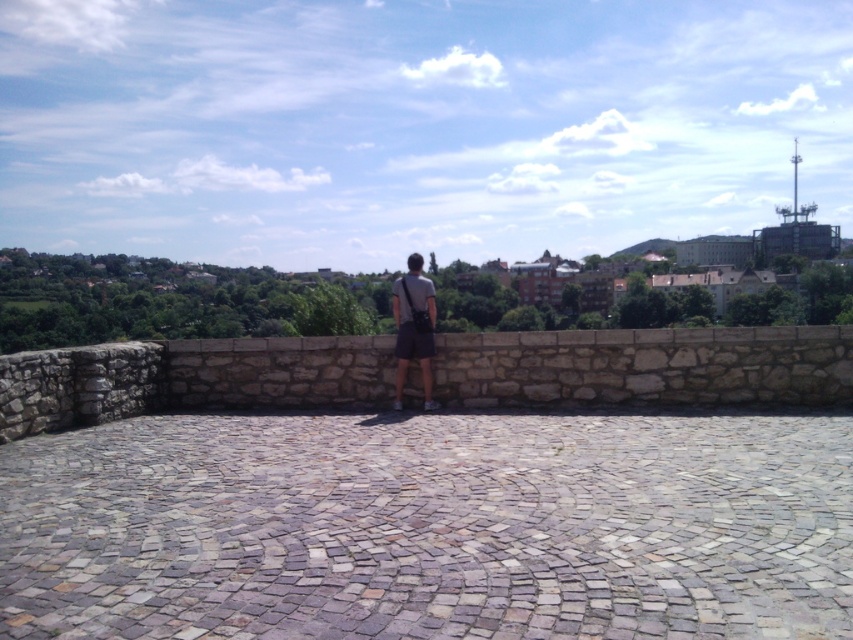
Question: Which point appears farthest from the camera in this image?

Choices:
 (A) (427, 344)
 (B) (57, 412)

Answer: (A)

Question: Which point appears closest to the camera in this image?

Choices:
 (A) (257, 346)
 (B) (426, 374)

Answer: (B)

Question: Does stone at center appear over dark gray fabric bag at center?

Choices:
 (A) no
 (B) yes

Answer: (A)

Question: Is stone at center positioned in front of dark gray fabric bag at center?

Choices:
 (A) yes
 (B) no

Answer: (A)

Question: Does stone at center come behind dark gray fabric bag at center?

Choices:
 (A) yes
 (B) no

Answer: (B)